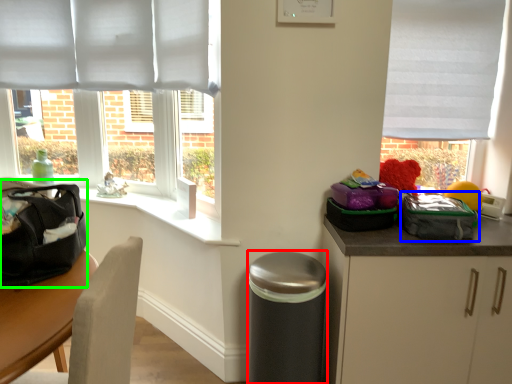
Question: Which is nearer to the garbage (highlighted by a red box)? kit (highlighted by a blue box) or pack (highlighted by a green box).

Choices:
 (A) kit
 (B) pack

Answer: (A)